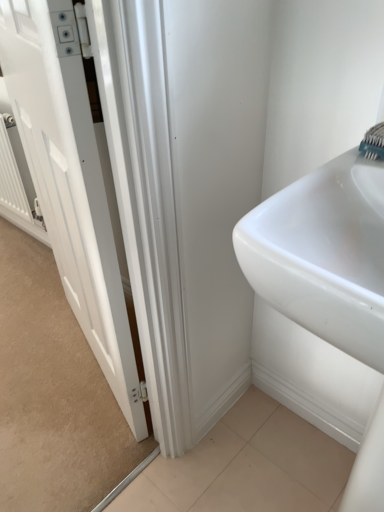
Describe the element at coordinates (70, 181) in the screenshot. I see `white glossy door at left` at that location.

This screenshot has height=512, width=384. What do you see at coordinates (11, 174) in the screenshot?
I see `white metallic radiator at left` at bounding box center [11, 174].

Locate an element on the screen. The width and height of the screenshot is (384, 512). white glossy door at left is located at coordinates (70, 181).

From the picture: Considering the sizes of objects teal plastic toothbrush at upper right and white metallic radiator at left in the image provided, who is shorter, teal plastic toothbrush at upper right or white metallic radiator at left?

teal plastic toothbrush at upper right is shorter.

In the image, there is a teal plastic toothbrush at upper right. Where is `radiator below it (from a real-world perspective)`? The height and width of the screenshot is (512, 384). radiator below it (from a real-world perspective) is located at coordinates (11, 174).

Is teal plastic toothbrush at upper right oriented away from white metallic radiator at left?

No, teal plastic toothbrush at upper right is not facing away from white metallic radiator at left.

From a real-world perspective, which object stands above the other?

teal plastic toothbrush at upper right, from a real-world perspective.

Does point (27, 36) come closer to viewer compared to point (10, 122)?

That is True.

Which object is further away from the camera taking this photo, white glossy door at left or white metallic radiator at left?

Positioned behind is white metallic radiator at left.

Looking at this image, in terms of size, does white glossy door at left appear bigger or smaller than white metallic radiator at left?

In the image, white glossy door at left appears to be larger than white metallic radiator at left.

Considering the points (43, 140) and (368, 142), which point is in front, point (43, 140) or point (368, 142)?

The point (368, 142) is more forward.

Is white glossy door at left completely or partially outside of teal plastic toothbrush at upper right?

white glossy door at left lies outside teal plastic toothbrush at upper right's area.

Is white glossy door at left beside teal plastic toothbrush at upper right?

No, white glossy door at left is not beside teal plastic toothbrush at upper right.

Considering the sizes of objects white glossy door at left and teal plastic toothbrush at upper right in the image provided, who is taller, white glossy door at left or teal plastic toothbrush at upper right?

With more height is white glossy door at left.

Image resolution: width=384 pixels, height=512 pixels. Find the location of `brush on the right of white metallic radiator at left`. brush on the right of white metallic radiator at left is located at coordinates (373, 142).

Considering the points (11, 163) and (369, 138), which point is behind, point (11, 163) or point (369, 138)?

The point (11, 163) is behind.

From their relative heights in the image, would you say white metallic radiator at left is taller or shorter than teal plastic toothbrush at upper right?

Considering their sizes, white metallic radiator at left has more height than teal plastic toothbrush at upper right.

Is white metallic radiator at left wider or thinner than teal plastic toothbrush at upper right?

Clearly, white metallic radiator at left has less width compared to teal plastic toothbrush at upper right.

Can you confirm if white metallic radiator at left is taller than white glossy door at left?

In fact, white metallic radiator at left may be shorter than white glossy door at left.

From the image's perspective, is white metallic radiator at left located above or below white glossy door at left?

Clearly, from the image's perspective, white metallic radiator at left is above white glossy door at left.

Measure the distance between white metallic radiator at left and white glossy door at left.

A distance of 27.43 inches exists between white metallic radiator at left and white glossy door at left.

Considering the relative sizes of white metallic radiator at left and white glossy door at left in the image provided, is white metallic radiator at left thinner than white glossy door at left?

In fact, white metallic radiator at left might be wider than white glossy door at left.

Could you tell me if teal plastic toothbrush at upper right is facing white glossy door at left?

No, teal plastic toothbrush at upper right is not facing towards white glossy door at left.

Between point (361, 150) and point (54, 147), which one is positioned in front?

The point (361, 150) is more forward.

Which is in front, teal plastic toothbrush at upper right or white glossy door at left?

white glossy door at left is closer to the camera.

From a real-world perspective, is teal plastic toothbrush at upper right located beneath white glossy door at left?

Incorrect, from a real-world perspective, teal plastic toothbrush at upper right is higher than white glossy door at left.

This screenshot has height=512, width=384. In order to click on brush above the white metallic radiator at left (from a real-world perspective) in this screenshot , I will do `click(373, 142)`.

Find the location of a particular element. This screenshot has width=384, height=512. radiator behind the white glossy door at left is located at coordinates (11, 174).

From the image, which object appears to be nearer to white glossy door at left, white metallic radiator at left or teal plastic toothbrush at upper right?

Among the two, teal plastic toothbrush at upper right is located nearer to white glossy door at left.

From the image, which object appears to be nearer to white glossy door at left, teal plastic toothbrush at upper right or white metallic radiator at left?

teal plastic toothbrush at upper right is positioned closer to the anchor white glossy door at left.

Estimate the real-world distances between objects in this image. Which object is further from teal plastic toothbrush at upper right, white metallic radiator at left or white glossy door at left?

white metallic radiator at left.

Estimate the real-world distances between objects in this image. Which object is further from teal plastic toothbrush at upper right, white glossy door at left or white metallic radiator at left?

white metallic radiator at left.

Consider the image. Considering their positions, is teal plastic toothbrush at upper right positioned further to white metallic radiator at left than white glossy door at left?

The object further to white metallic radiator at left is teal plastic toothbrush at upper right.

From the image, which object appears to be nearer to white metallic radiator at left, white glossy door at left or teal plastic toothbrush at upper right?

white glossy door at left lies closer to white metallic radiator at left than the other object.

Locate an element on the screen. The height and width of the screenshot is (512, 384). door between white metallic radiator at left and teal plastic toothbrush at upper right in the horizontal direction is located at coordinates pos(70,181).